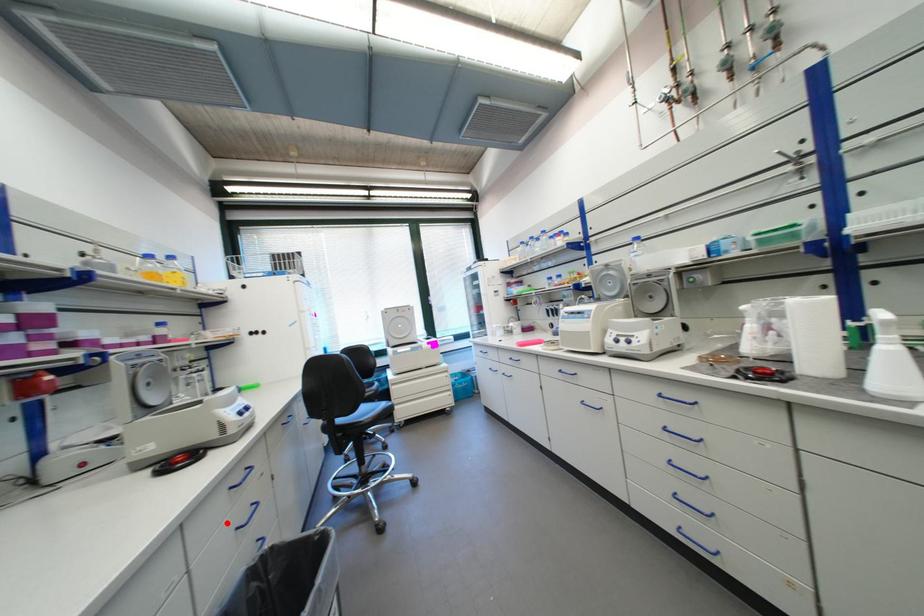
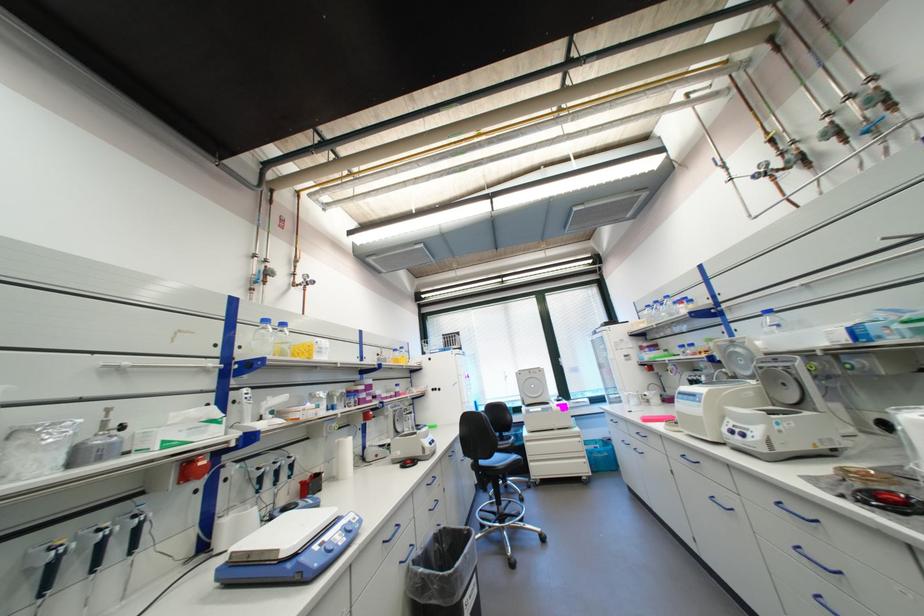
The point at the highlighted location is marked in the first image. Where is the corresponding point in the second image?

(431, 501)